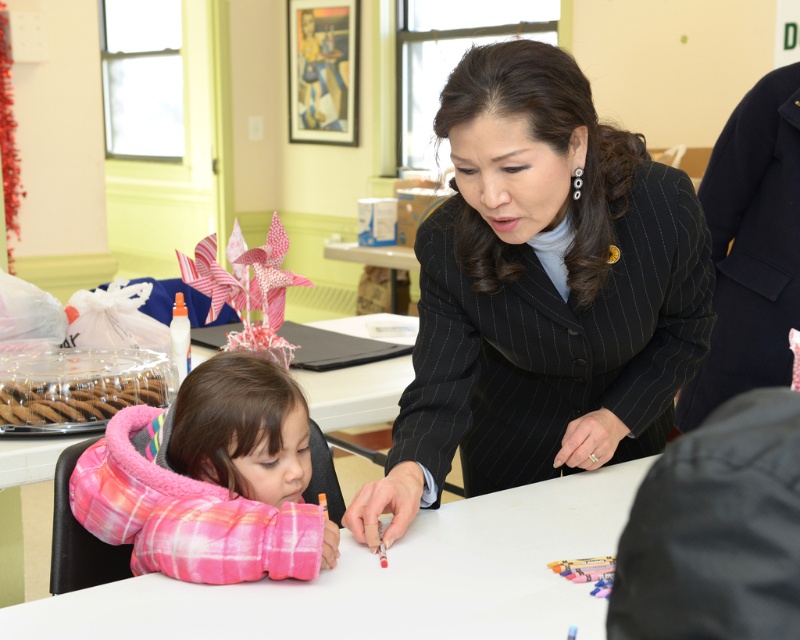
Between pink fleece jacket at lower left and black pinstripe suit at upper right, which one has less height?

pink fleece jacket at lower left is shorter.

Who is more distant from viewer, (216, 460) or (709, 177)?

The point (709, 177) is more distant.

Is point (318, 509) more distant than point (750, 301)?

No, it is not.

Where is `pink fleece jacket at lower left`? pink fleece jacket at lower left is located at coordinates (206, 480).

Can you confirm if white glossy table at center is smaller than black pinstripe suit at upper right?

Actually, white glossy table at center might be larger than black pinstripe suit at upper right.

Is point (408, 572) positioned after point (736, 125)?

No, it is not.

Identify the location of white glossy table at center. The height and width of the screenshot is (640, 800). 388,579.

What are the coordinates of `white glossy table at center` in the screenshot? It's located at (388, 579).

Does black pinstripe suit at center appear under white glossy table at center?

Actually, black pinstripe suit at center is above white glossy table at center.

Is black pinstripe suit at center taller than white glossy table at center?

Yes.

Who is more distant from viewer, (521, 348) or (392, 627)?

The point (521, 348) is behind.

I want to click on black pinstripe suit at center, so click(542, 291).